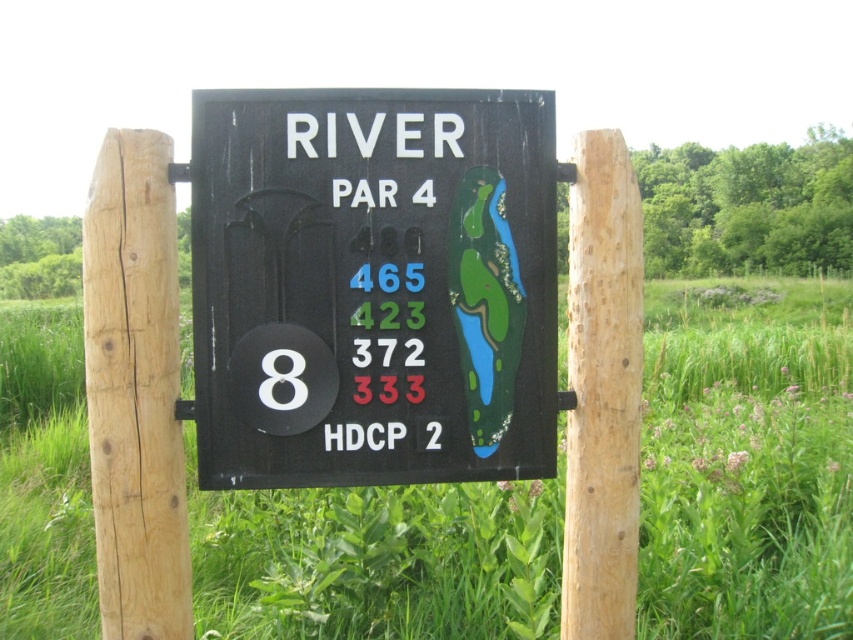
Question: Is light brown wood post at left further to the viewer compared to natural wood post at center?

Choices:
 (A) yes
 (B) no

Answer: (B)

Question: Estimate the real-world distances between objects in this image. Which object is farther from the natural wood post at center?

Choices:
 (A) light brown wood post at left
 (B) black matte sign at center

Answer: (A)

Question: Which point is farther to the camera?

Choices:
 (A) light brown wood post at left
 (B) natural wood post at center

Answer: (B)

Question: Can you confirm if black matte sign at center is positioned above light brown wood post at left?

Choices:
 (A) yes
 (B) no

Answer: (A)

Question: Estimate the real-world distances between objects in this image. Which object is farther from the light brown wood post at left?

Choices:
 (A) black matte sign at center
 (B) natural wood post at center

Answer: (B)

Question: Is black matte sign at center above natural wood post at center?

Choices:
 (A) no
 (B) yes

Answer: (B)